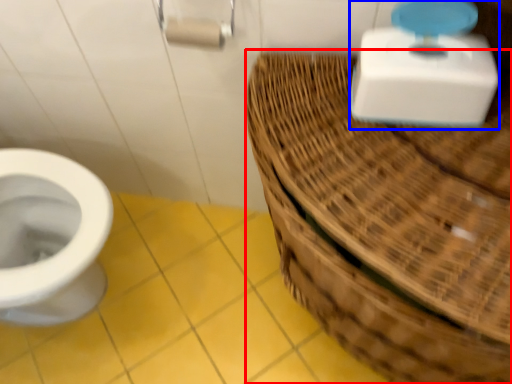
Question: Which object appears farthest to the camera in this image, basket (highlighted by a red box) or scale (highlighted by a blue box)?

Choices:
 (A) basket
 (B) scale

Answer: (B)